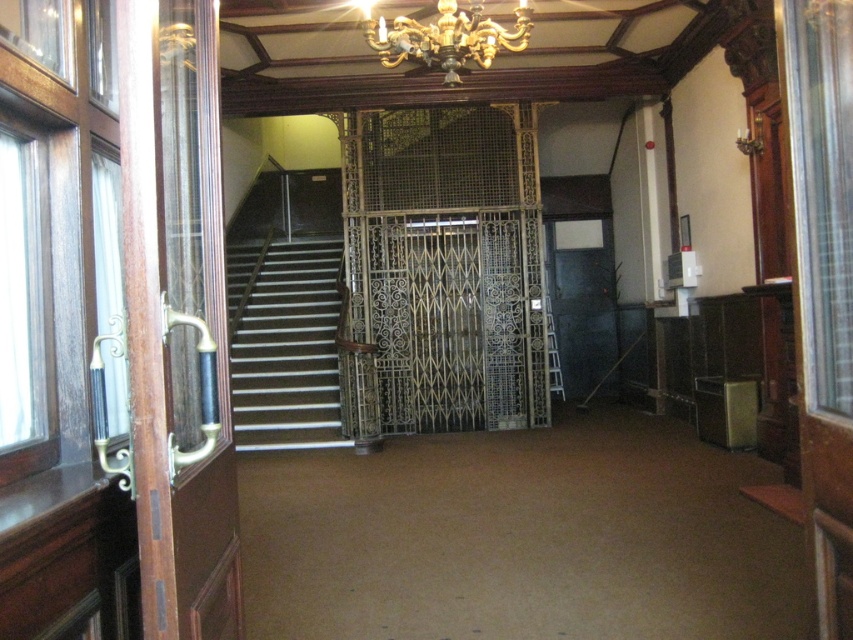
Question: From the image, what is the correct spatial relationship of wrought iron elevator at center in relation to gold metallic chandelier at upper center?

Choices:
 (A) right
 (B) left

Answer: (A)

Question: Is white glossy stairs at center in front of gold metallic chandelier at upper center?

Choices:
 (A) no
 (B) yes

Answer: (A)

Question: Which is farther from the wrought iron elevator at center?

Choices:
 (A) white glossy stairs at center
 (B) gold metallic chandelier at upper center

Answer: (B)

Question: Which object is positioned closest to the gold metallic chandelier at upper center?

Choices:
 (A) wrought iron elevator at center
 (B) white glossy stairs at center

Answer: (A)

Question: Among these objects, which one is farthest from the camera?

Choices:
 (A) gold metallic chandelier at upper center
 (B) wrought iron elevator at center
 (C) white glossy stairs at center

Answer: (C)

Question: Does wrought iron elevator at center appear on the left side of white glossy stairs at center?

Choices:
 (A) yes
 (B) no

Answer: (B)